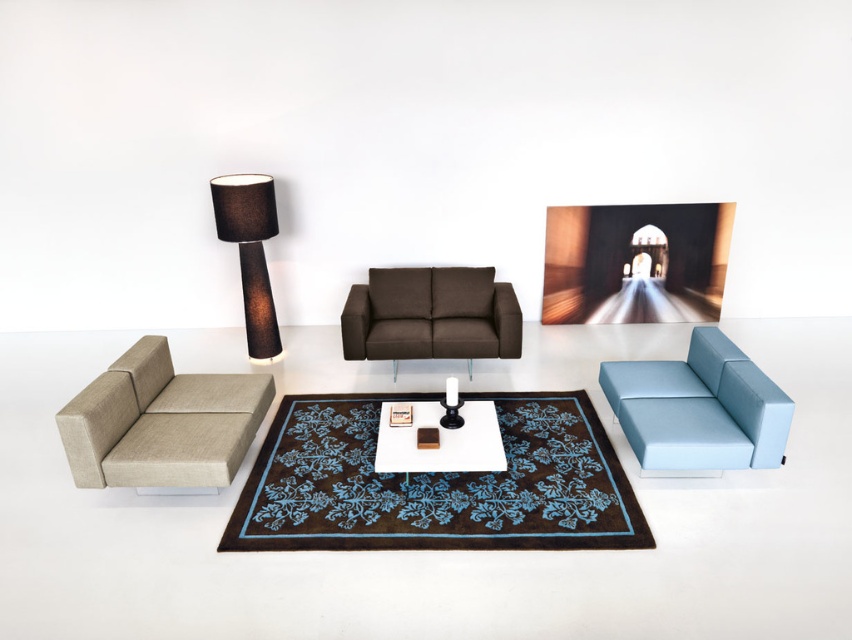
Question: Is beige fabric armchair at left smaller than light blue fabric armchair at right?

Choices:
 (A) yes
 (B) no

Answer: (B)

Question: Can you confirm if light blue fabric armchair at right is positioned above white glossy table at center?

Choices:
 (A) no
 (B) yes

Answer: (B)

Question: Which point is farther from the camera taking this photo?

Choices:
 (A) (240, 200)
 (B) (205, 445)
 (C) (363, 285)
 (D) (448, 428)

Answer: (C)

Question: Which point appears closest to the camera in this image?

Choices:
 (A) (112, 376)
 (B) (250, 323)

Answer: (A)

Question: Among these points, which one is nearest to the camera?

Choices:
 (A) (741, 397)
 (B) (450, 442)
 (C) (191, 484)
 (D) (217, 177)

Answer: (C)

Question: Can you confirm if beige fabric armchair at left is thinner than black fabric lamp at upper left?

Choices:
 (A) yes
 (B) no

Answer: (B)